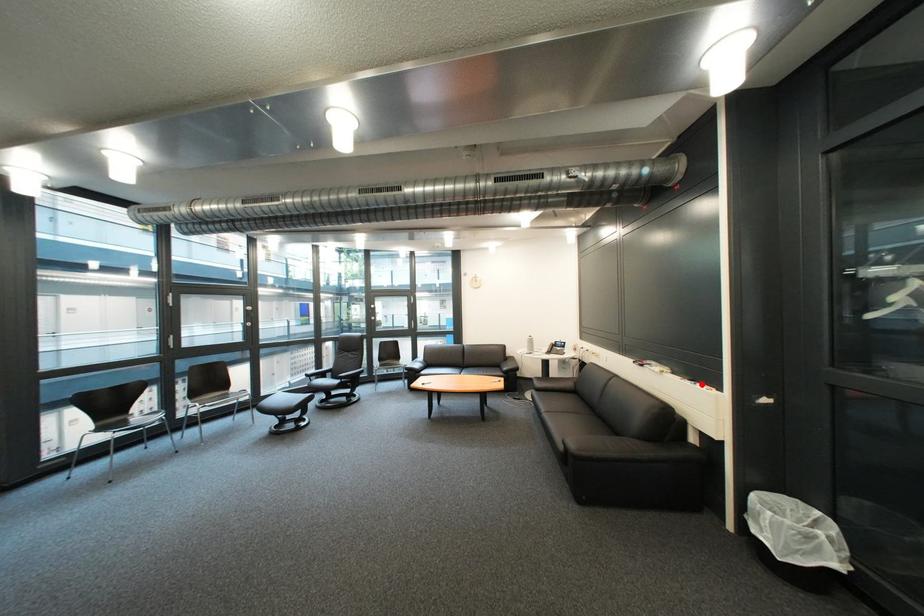
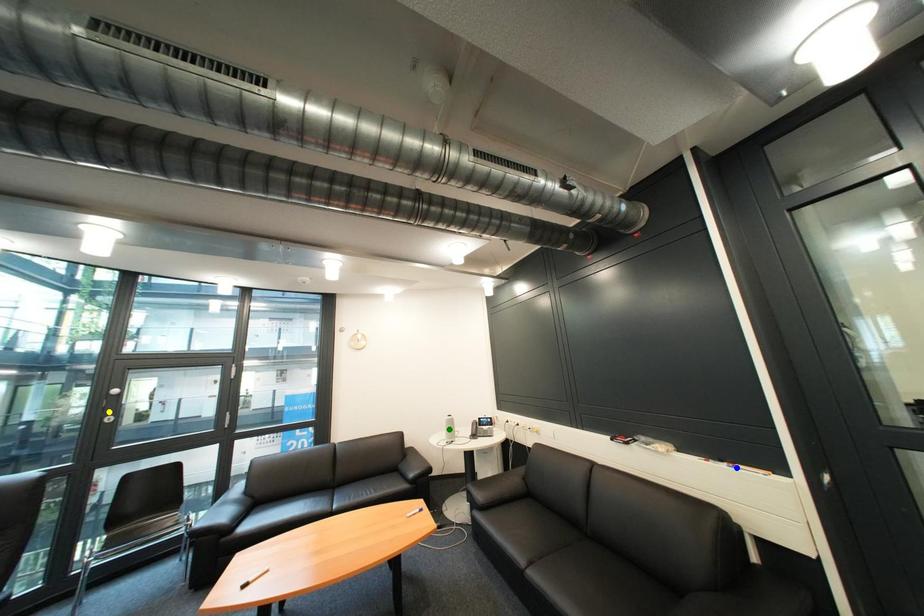
Question: I am providing you with two images of the same scene from different viewpoints. A red point is marked on the first image. You are given multiple points on the second image. Can you choose the point in image 2 that corresponds to the point in image 1?

Choices:
 (A) yellow point
 (B) green point
 (C) blue point

Answer: (C)